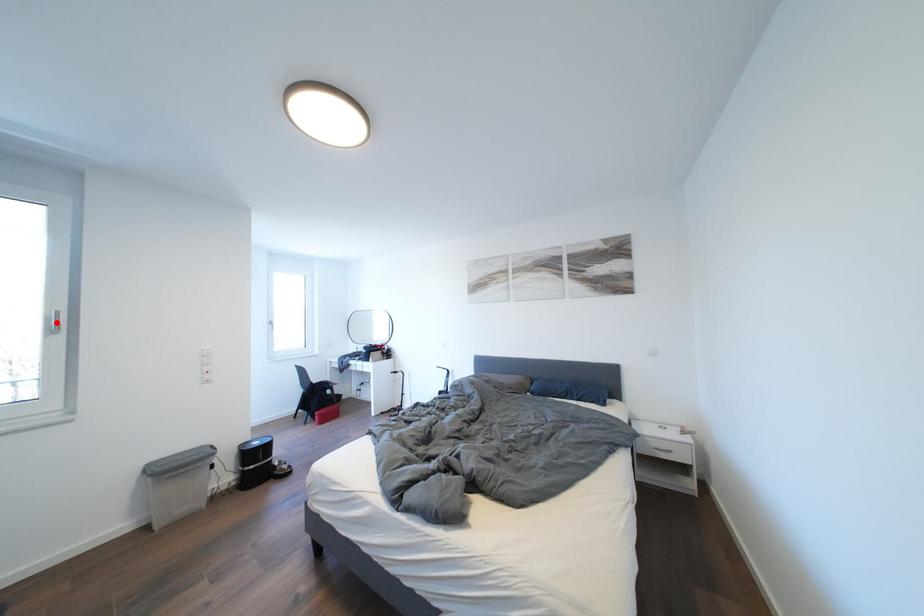
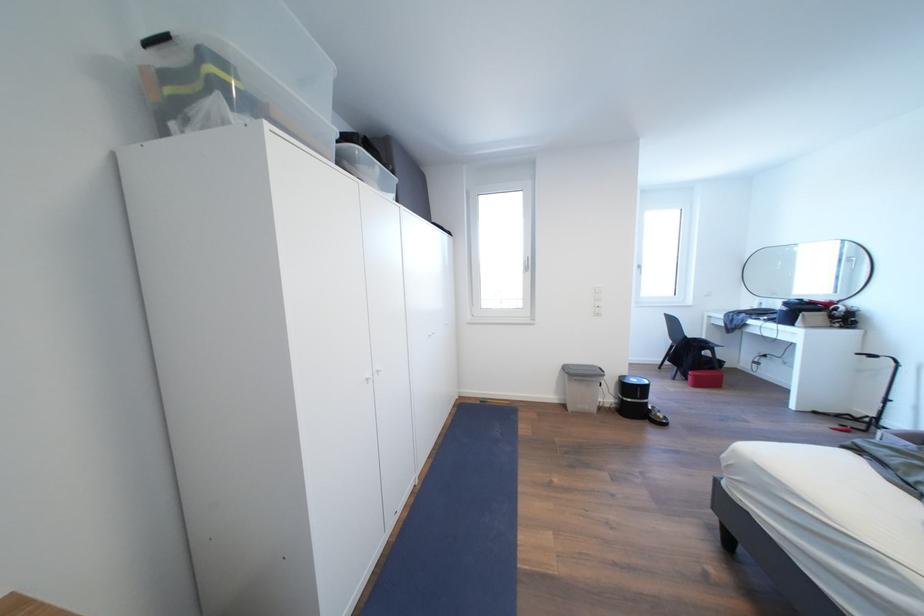
The point at the highlighted location is marked in the first image. Where is the corresponding point in the second image?

(532, 267)